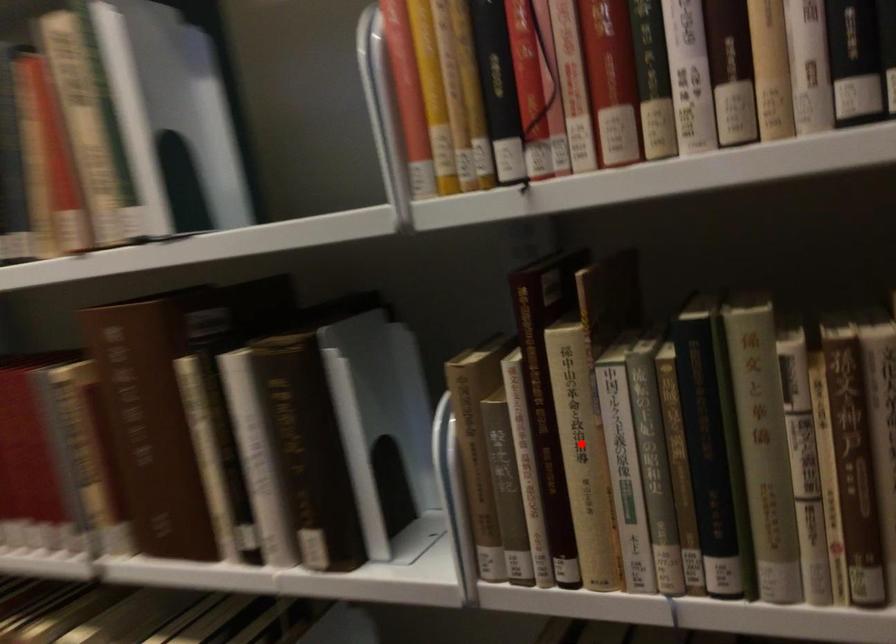
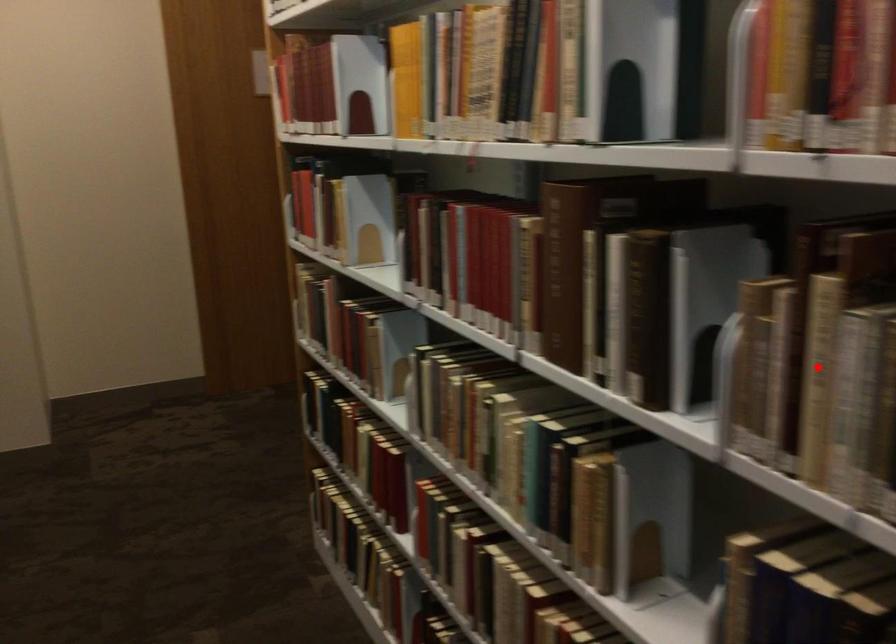
I am providing you with two images of the same scene from different viewpoints. A red point is marked on the first image and another point is marked on the second image. Is the red point in image1 aligned with the point shown in image2?

Yes